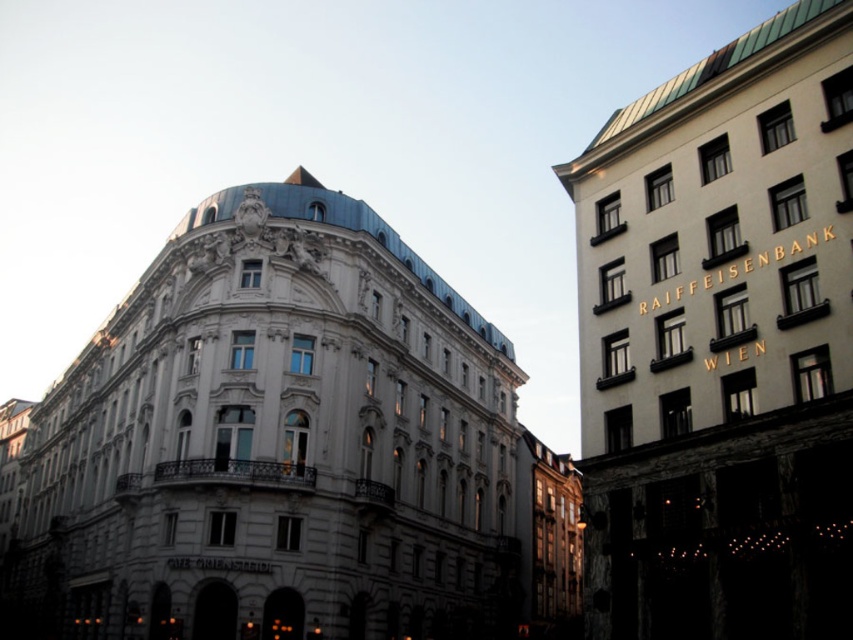
Does white stone building at upper right have a greater width compared to matte white building at center?

Yes, white stone building at upper right is wider than matte white building at center.

Does white stone building at upper right have a lesser height compared to matte white building at center?

Incorrect, white stone building at upper right's height does not fall short of matte white building at center's.

Find the location of `white stone building at upper right`. white stone building at upper right is located at coordinates (721, 342).

Who is more distant from viewer, (x=39, y=464) or (x=787, y=8)?

Point (x=39, y=464)

Does white stone building at center appear over white stone building at upper right?

No.

Which is behind, point (405, 346) or point (628, 182)?

Point (405, 346)

This screenshot has height=640, width=853. What are the coordinates of `white stone building at center` in the screenshot? It's located at (270, 444).

Can you confirm if white stone building at center is thinner than matte white building at center?

Incorrect, white stone building at center's width is not less than matte white building at center's.

Between white stone building at center and matte white building at center, which one appears on the right side from the viewer's perspective?

From the viewer's perspective, matte white building at center appears more on the right side.

Is point (485, 401) positioned behind point (556, 582)?

That is False.

Where is `white stone building at center`? The width and height of the screenshot is (853, 640). white stone building at center is located at coordinates (270, 444).